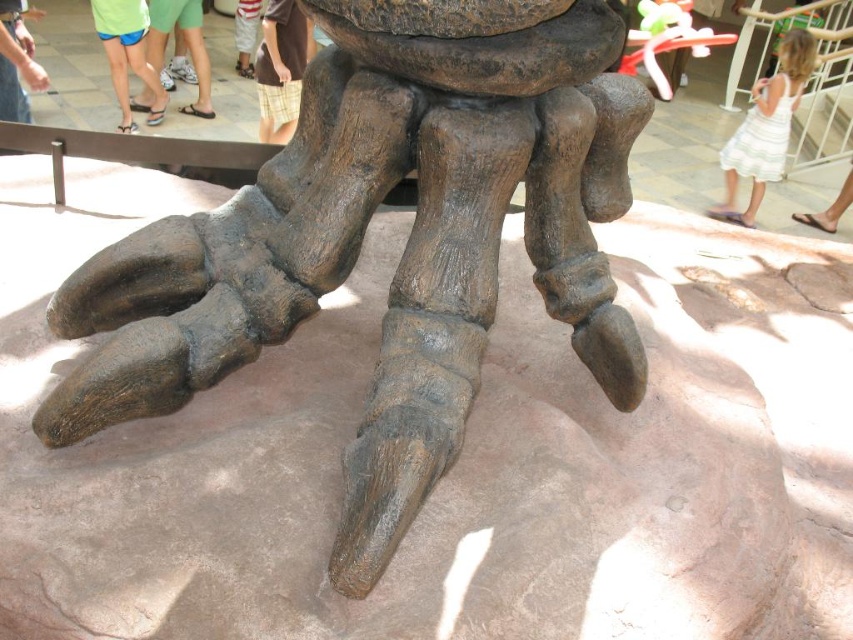
Question: Is white striped dress at upper right bigger than brown plaid shorts at center?

Choices:
 (A) yes
 (B) no

Answer: (A)

Question: Among these points, which one is nearest to the camera?

Choices:
 (A) (256, 1)
 (B) (276, 3)
 (C) (764, 84)
 (D) (840, 202)

Answer: (B)

Question: Which point is farther to the camera?

Choices:
 (A) (1, 86)
 (B) (180, 33)
 (C) (238, 29)
 (D) (258, 84)

Answer: (C)

Question: Can you confirm if white striped dress at upper right is thinner than green fabric shorts at lower left?

Choices:
 (A) no
 (B) yes

Answer: (A)

Question: Observing the image, what is the correct spatial positioning of rough stone dinosaur foot at center in reference to white striped shorts at lower center?

Choices:
 (A) below
 (B) above

Answer: (A)

Question: Among these points, which one is farthest from the camera?

Choices:
 (A) (291, 52)
 (B) (200, 70)
 (C) (18, 17)
 (D) (550, 182)

Answer: (B)